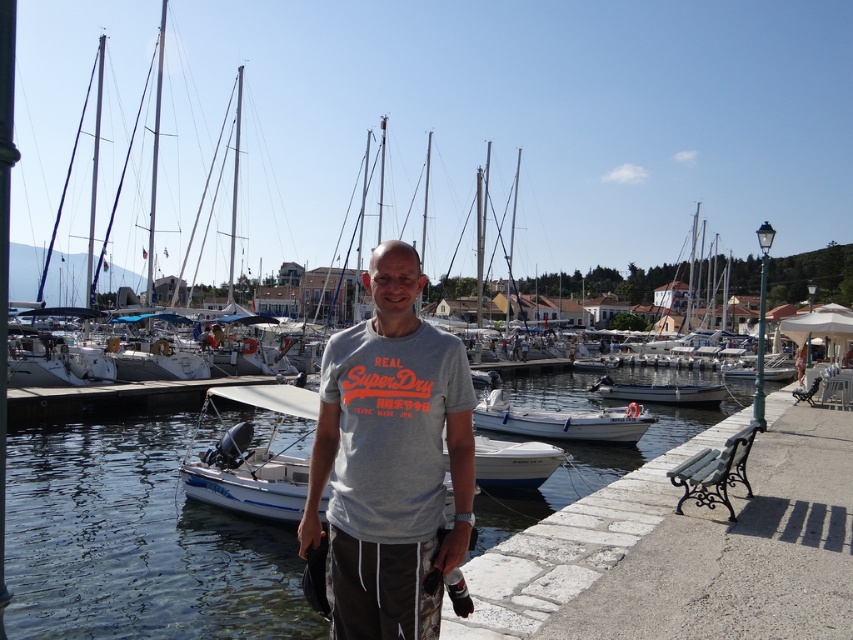
Between point (393, 355) and point (506, 406), which one is positioned behind?

Positioned behind is point (506, 406).

Which is more to the right, gray cotton t-shirt at center or white plastic boat at lower center?

From the viewer's perspective, white plastic boat at lower center appears more on the right side.

At what (x,y) coordinates should I click in order to perform the action: click on gray cotton t-shirt at center. Please return your answer as a coordinate pair (x, y). The image size is (853, 640). Looking at the image, I should click on (390, 460).

Does gray cotton t-shirt at center have a greater width compared to white fiberglass boat at center?

No, gray cotton t-shirt at center is not wider than white fiberglass boat at center.

Between point (393, 458) and point (672, 396), which one is positioned in front?

Point (393, 458) is in front.

Find the location of a particular element. gray cotton t-shirt at center is located at coordinates (390, 460).

Is clear water at center bigger than white matte boat at center?

Yes, clear water at center is bigger than white matte boat at center.

Between clear water at center and white matte boat at center, which one has more height?

white matte boat at center is taller.

Locate an element on the screen. The image size is (853, 640). clear water at center is located at coordinates (137, 541).